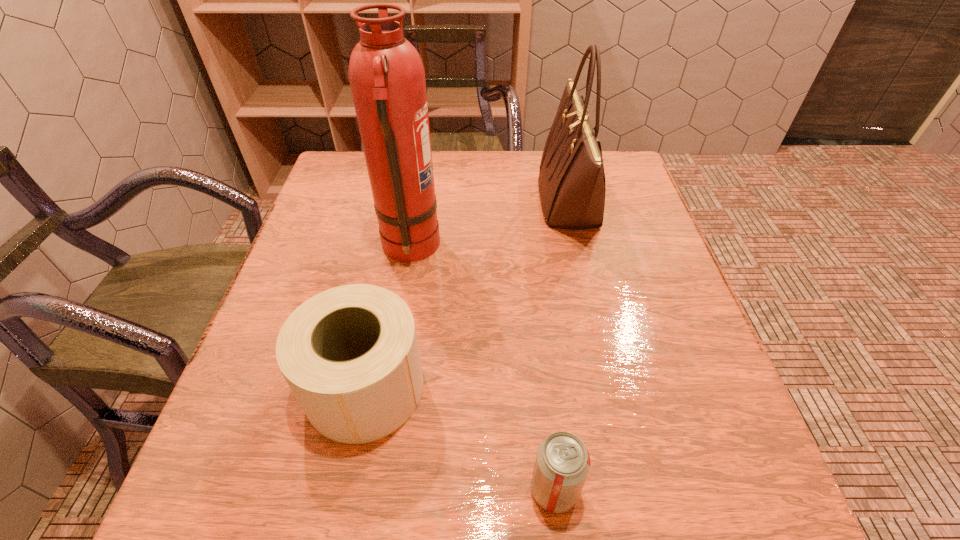
Identify the location of vacant area between the shortest object and the fire extinguisher. point(482,369).

The image size is (960, 540). I want to click on object that ranks as the third closest to the shortest object, so click(572, 187).

Locate an element on the screen. This screenshot has height=540, width=960. object that stands as the third closest to the tallest object is located at coordinates (562, 464).

Where is `free point that satisfies the following two spatial constraints: 1. on the label side of the tallest object; 2. on the right side of the soda can`? Image resolution: width=960 pixels, height=540 pixels. free point that satisfies the following two spatial constraints: 1. on the label side of the tallest object; 2. on the right side of the soda can is located at coordinates (372, 490).

Locate an element on the screen. free location that satisfies the following two spatial constraints: 1. on the label side of the soda can; 2. on the right side of the tallest object is located at coordinates (372, 490).

What are the coordinates of `vacant space that satisfies the following two spatial constraints: 1. on the label side of the tallest object; 2. on the back side of the nearest object` in the screenshot? It's located at (372, 490).

In order to click on free region that satisfies the following two spatial constraints: 1. on the back side of the shortest object; 2. on the label side of the fire extinguisher in this screenshot , I will do `click(527, 248)`.

The width and height of the screenshot is (960, 540). I want to click on free region that satisfies the following two spatial constraints: 1. on the label side of the soda can; 2. on the right side of the fire extinguisher, so click(372, 490).

This screenshot has width=960, height=540. I want to click on vacant region that satisfies the following two spatial constraints: 1. on the front-facing side of the handbag; 2. on the front side of the toilet tissue, so click(613, 387).